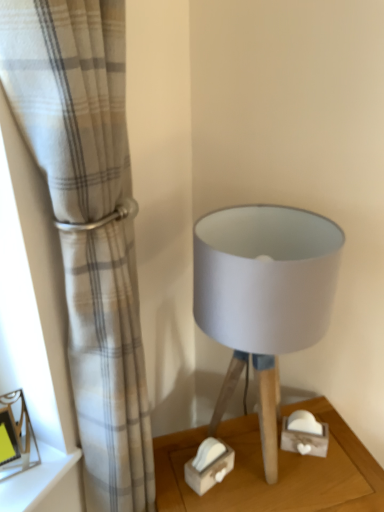
Question: Is wooden tissue box at lower center positioned with its back to white textured curtain at left?

Choices:
 (A) no
 (B) yes

Answer: (B)

Question: Is wooden tissue box at lower center outside white textured curtain at left?

Choices:
 (A) yes
 (B) no

Answer: (A)

Question: Is white textured curtain at left a part of wooden tissue box at lower center?

Choices:
 (A) no
 (B) yes

Answer: (A)

Question: From the image's perspective, is wooden tissue box at lower center on white textured curtain at left?

Choices:
 (A) no
 (B) yes

Answer: (A)

Question: Is wooden tissue box at lower center shorter than white textured curtain at left?

Choices:
 (A) yes
 (B) no

Answer: (A)

Question: Is wooden tissue box at lower center at the left side of white textured curtain at left?

Choices:
 (A) yes
 (B) no

Answer: (B)

Question: From a real-world perspective, is matte gray fabric lampshade at center over white textured curtain at left?

Choices:
 (A) yes
 (B) no

Answer: (A)

Question: Is matte gray fabric lampshade at center surrounding white textured curtain at left?

Choices:
 (A) no
 (B) yes

Answer: (A)

Question: Considering the relative sizes of matte gray fabric lampshade at center and white textured curtain at left in the image provided, is matte gray fabric lampshade at center smaller than white textured curtain at left?

Choices:
 (A) no
 (B) yes

Answer: (B)

Question: Is matte gray fabric lampshade at center outside white textured curtain at left?

Choices:
 (A) no
 (B) yes

Answer: (B)

Question: Is matte gray fabric lampshade at center not close to white textured curtain at left?

Choices:
 (A) no
 (B) yes

Answer: (A)

Question: Is matte gray fabric lampshade at center positioned behind white textured curtain at left?

Choices:
 (A) no
 (B) yes

Answer: (B)

Question: Could you tell me if wooden tissue box at lower center is turned towards matte white frame at lower left?

Choices:
 (A) yes
 (B) no

Answer: (B)